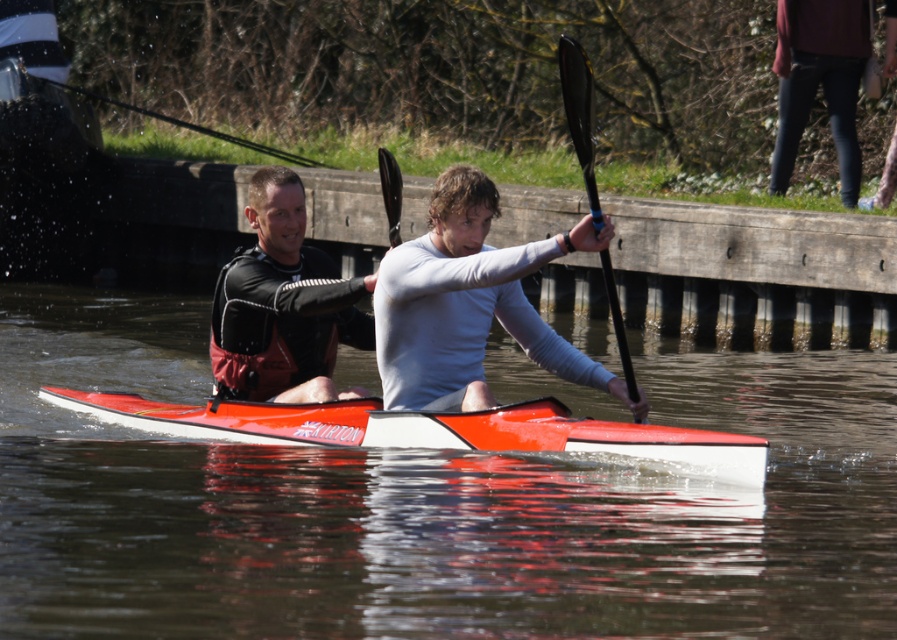
You are a photographer planning to take a photo of the black neoprene wetsuit at left and the black rubber paddle at upper center. You want to ensure both are visible in the frame. Based on their sizes, which object might require you to adjust your camera angle to include it fully?

The black neoprene wetsuit at left is shorter than the black rubber paddle at upper center, so you might need to adjust your camera angle to include the taller black rubber paddle at upper center in the frame.

Based on the photo, you are a photographer trying to capture a clear shot of both the white matte kayak at center and the black rubber paddle at upper center. Based on their positions, which object should you focus on first to ensure both are in frame?

The white matte kayak at center is located below the black rubber paddle at upper center, so you should focus on the black rubber paddle at upper center first to ensure both are in frame.

You are a photographer trying to capture a clear shot of the black neoprene wetsuit at left and the black rubber paddle at upper center. Based on their positions, which object will appear closer to the bottom of your camera frame?

The black neoprene wetsuit at left is located below the black rubber paddle at upper center, so it will appear closer to the bottom of the camera frame.